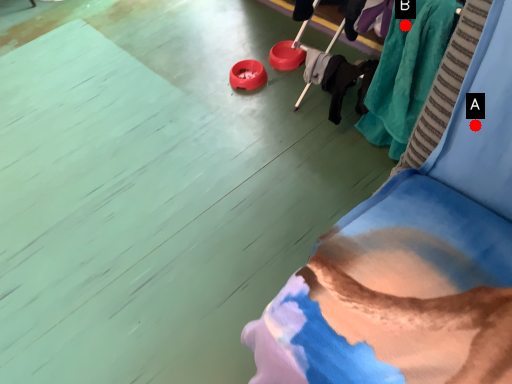
Question: Two points are circled on the image, labeled by A and B beside each circle. Which point appears closest to the camera in this image?

Choices:
 (A) A is closer
 (B) B is closer

Answer: (A)